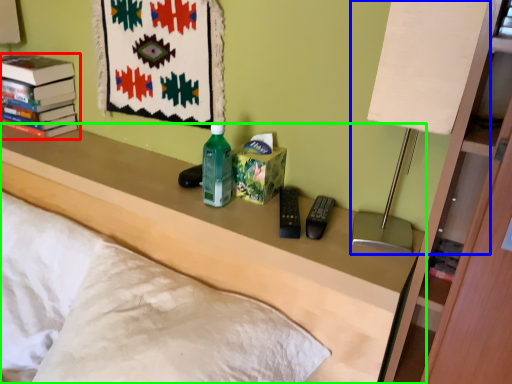
Question: Which object is the farthest from book (highlighted by a red box)? Choose among these: table lamp (highlighted by a blue box) or furniture (highlighted by a green box).

Choices:
 (A) table lamp
 (B) furniture

Answer: (A)